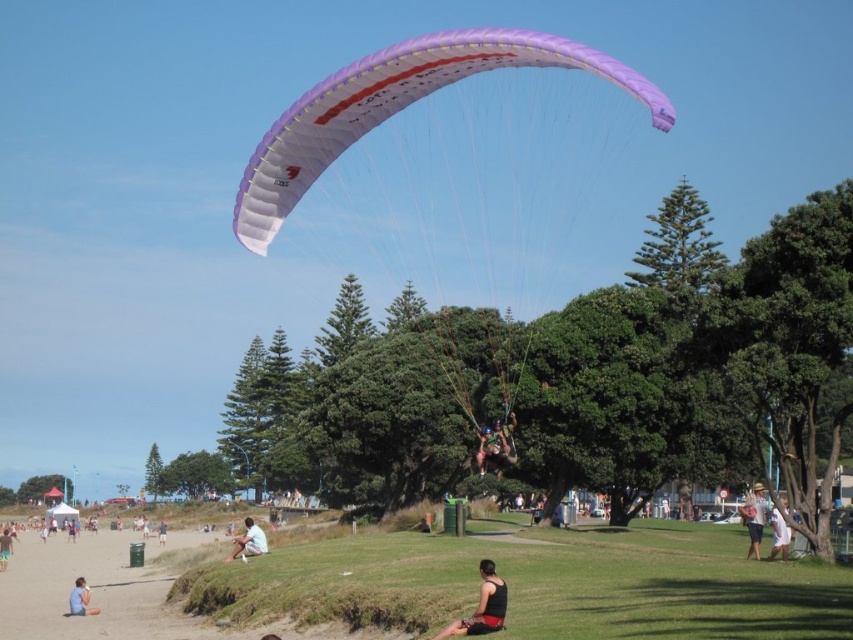
Based on the photo, you are standing at the beachside park and want to know which of the two points, point (260, 202) or point (90, 609), is closer to you. Can you determine this based on the scene?

Point (260, 202) is closer to the viewer than point (90, 609).

You are a photographer at the beachside park scene. You need to capture a photo of the black fabric shorts at lower center and the light blue fabric shorts at lower center. Which pair of shorts will be closer to the camera in the photo?

The black fabric shorts at lower center is in front of the light blue fabric shorts at lower center, so the black fabric shorts at lower center will be closer to the camera in the photo.